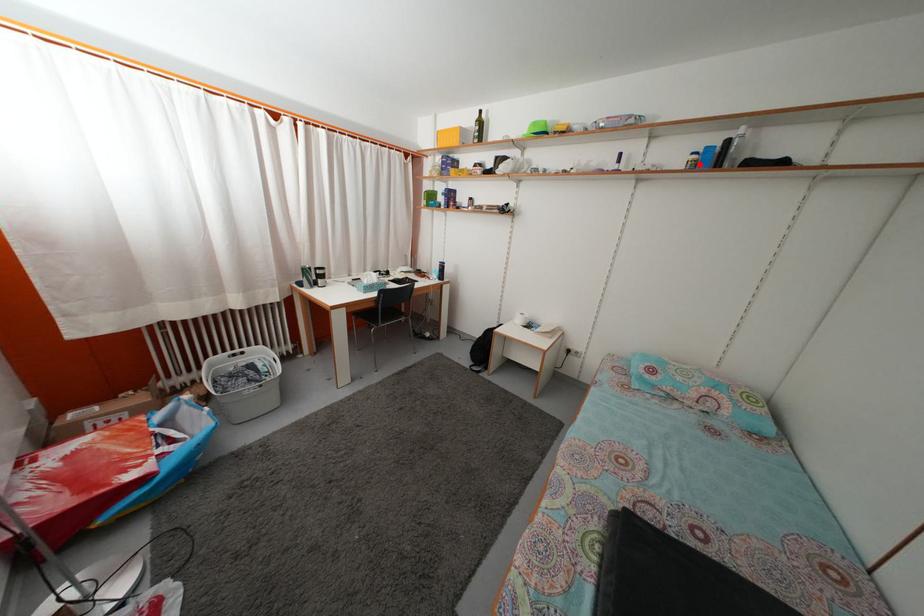
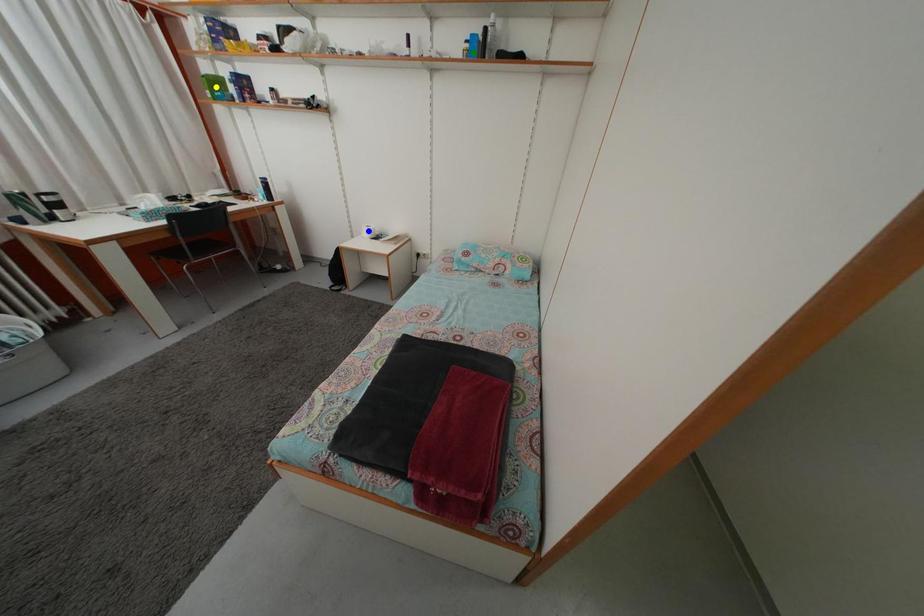
Question: I am providing you with two images of the same scene from different viewpoints. A red point is marked on the first image. You are given multiple points on the second image. Which point in image 2 is actually the same real-world point as the red point in image 1?

Choices:
 (A) green point
 (B) blue point
 (C) yellow point

Answer: (A)